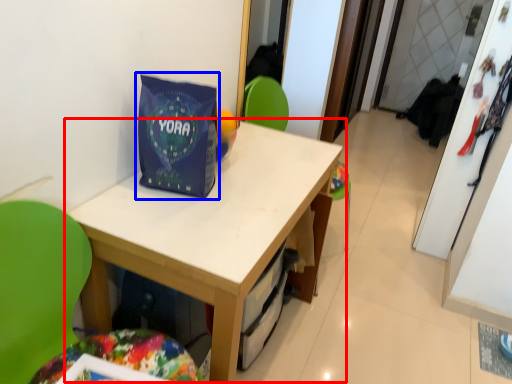
Question: Which object is further to the camera taking this photo, table (highlighted by a red box) or gift bag (highlighted by a blue box)?

Choices:
 (A) table
 (B) gift bag

Answer: (B)